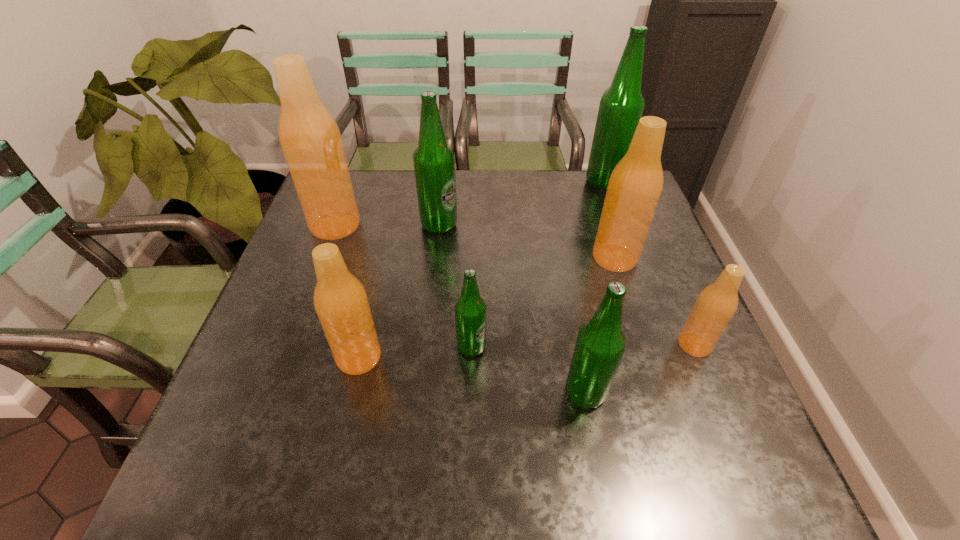
In the image, there is a desktop. At what (x,y) coordinates should I click in order to perform the action: click on free region at the far edge. Please return your answer as a coordinate pair (x, y). Looking at the image, I should click on (527, 210).

Identify the location of vacant space at the left edge of the desktop. The height and width of the screenshot is (540, 960). (289, 388).

In the image, there is a desktop. Find the location of `vacant space at the right edge`. vacant space at the right edge is located at coordinates (657, 230).

The image size is (960, 540). Identify the location of vacant space at the near right corner of the desktop. (759, 488).

Find the location of a particular element. Image resolution: width=960 pixels, height=540 pixels. vacant space that is in between the fourth object from right to left and the smallest tan beer bottle is located at coordinates (639, 368).

Find the location of a particular element. free point between the farthest green beer bottle and the second smallest tan beer bottle is located at coordinates (482, 269).

Locate an element on the screen. This screenshot has width=960, height=540. vacant space in between the smallest tan beer bottle and the second smallest green beer bottle is located at coordinates (639, 368).

You are a GUI agent. You are given a task and a screenshot of the screen. Output one action in this format:
    pyautogui.click(x=<x>, y=<y>)
    Task: Click on the free spot between the third beer bottle from left to right and the leftmost beer bottle
    The height and width of the screenshot is (540, 960).
    Given the screenshot: What is the action you would take?
    pyautogui.click(x=387, y=225)

Find the location of a particular element. The height and width of the screenshot is (540, 960). empty location between the fifth nearest beer bottle and the second nearest green beer bottle is located at coordinates (543, 302).

The width and height of the screenshot is (960, 540). Find the location of `free space between the biggest green beer bottle and the smallest tan beer bottle`. free space between the biggest green beer bottle and the smallest tan beer bottle is located at coordinates (650, 263).